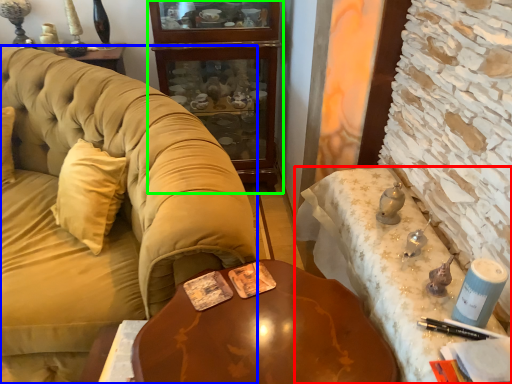
Question: Estimate the real-world distances between objects in this image. Which object is farther from desk (highlighted by a red box), studio couch (highlighted by a blue box) or cabinetry (highlighted by a green box)?

Choices:
 (A) studio couch
 (B) cabinetry

Answer: (B)